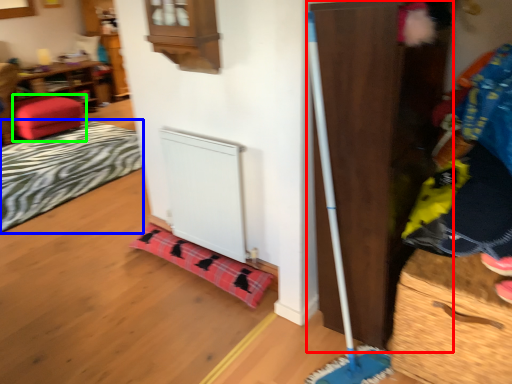
Question: Which object is positioned closest to dresser (highlighted by a red box)? Select from blanket (highlighted by a blue box) and furniture (highlighted by a green box).

Choices:
 (A) blanket
 (B) furniture

Answer: (A)